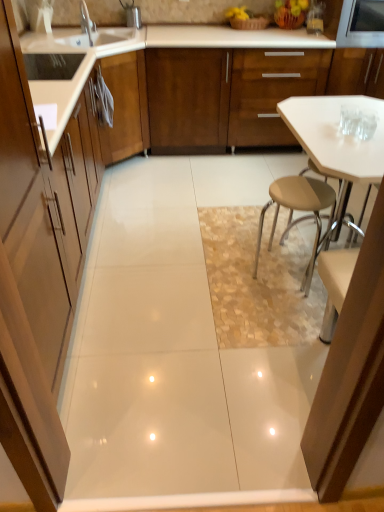
Find the location of a particular element. The width and height of the screenshot is (384, 512). vacant area that lies between matte wood cabinet at left, which is counted as the first cabinetry, starting from the bottom, and white glossy table at center is located at coordinates pos(191,334).